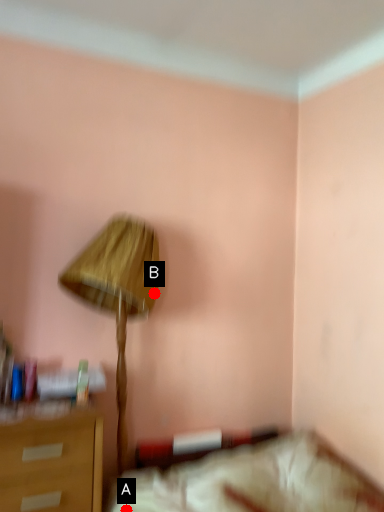
Question: Two points are circled on the image, labeled by A and B beside each circle. Which point appears farthest from the camera in this image?

Choices:
 (A) A is further
 (B) B is further

Answer: (B)